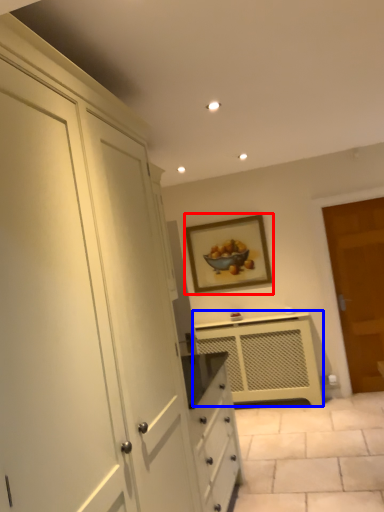
Question: Which of the following is the farthest to the observer, picture frame (highlighted by a red box) or cabinetry (highlighted by a blue box)?

Choices:
 (A) picture frame
 (B) cabinetry

Answer: (A)